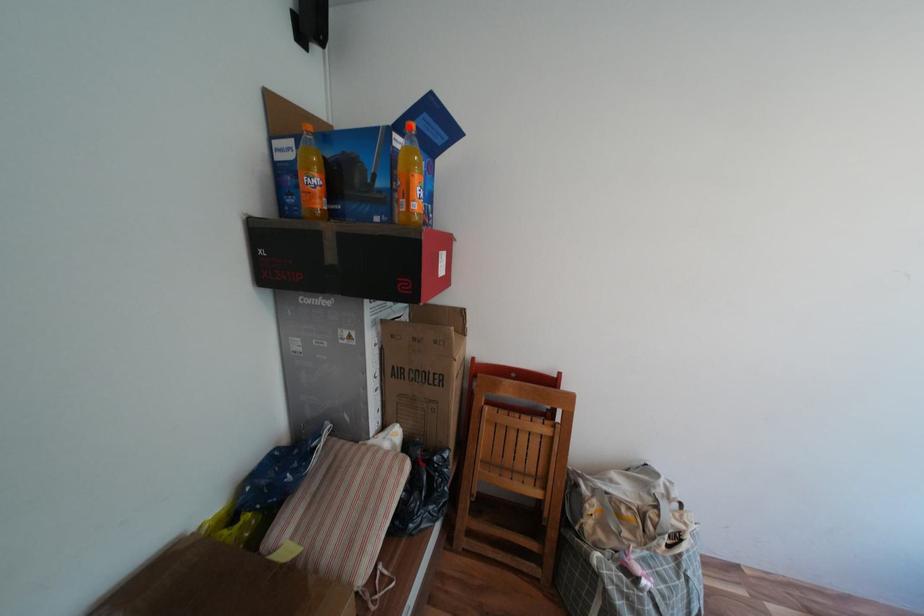
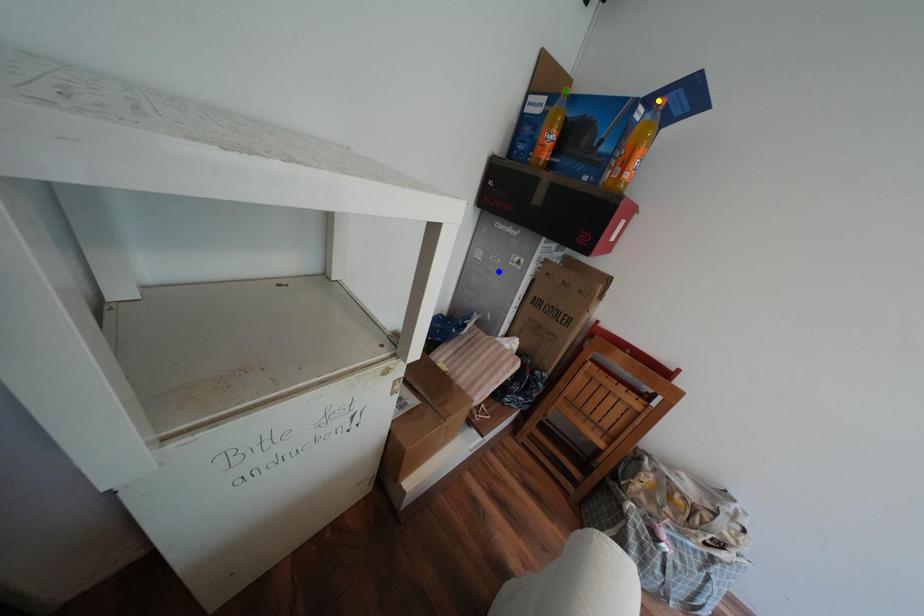
Question: I am providing you with two images of the same scene from different viewpoints. A red point is marked on the first image. You are given multiple points on the second image. Which point in image 2 is actually the same real-world point as the red point in image 1?

Choices:
 (A) green point
 (B) yellow point
 (C) blue point

Answer: (B)